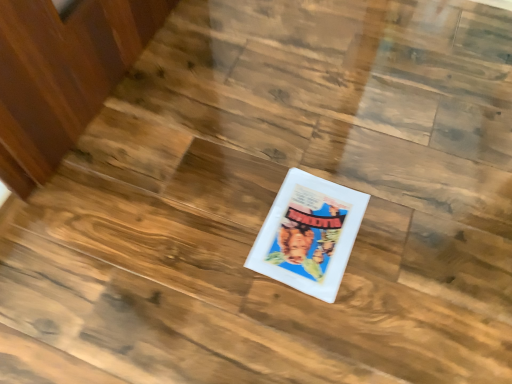
The height and width of the screenshot is (384, 512). What are the coordinates of `vacant space situated on the left part of white glossy book at center` in the screenshot? It's located at (218, 218).